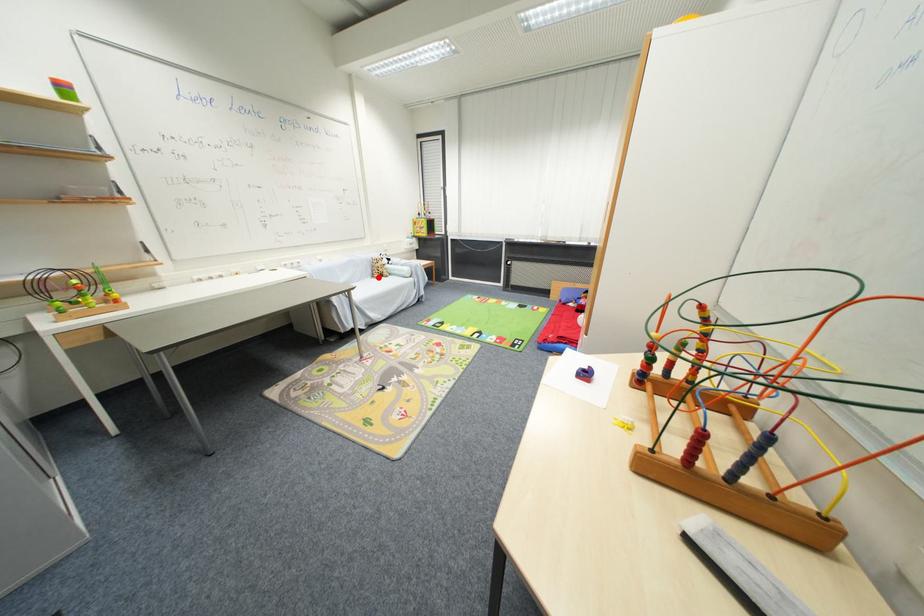
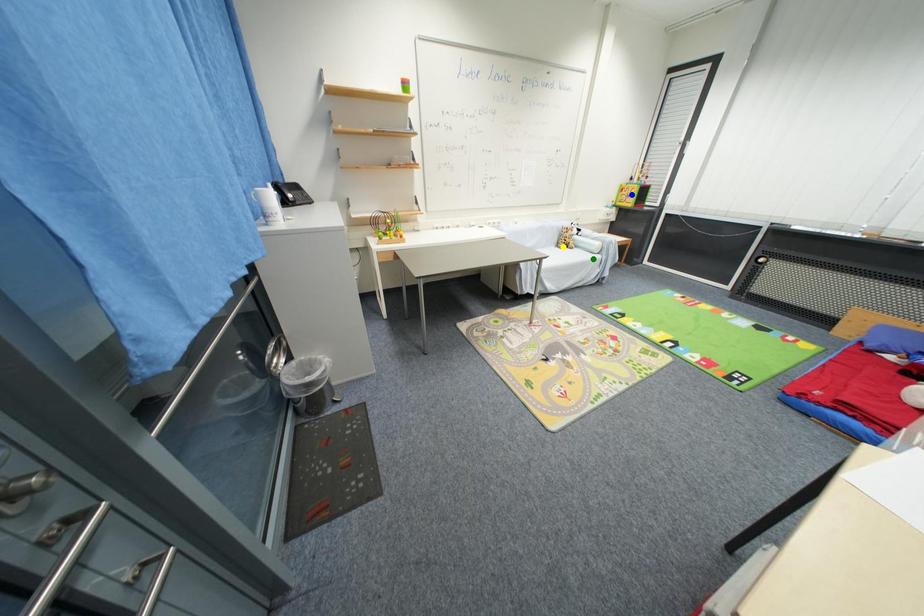
Question: I am providing you with two images of the same scene from different viewpoints. A red point is marked on the first image. You are given multiple points on the second image. Which spot in image 2 lines up with the point in image 1?

Choices:
 (A) green point
 (B) blue point
 (C) yellow point

Answer: (C)